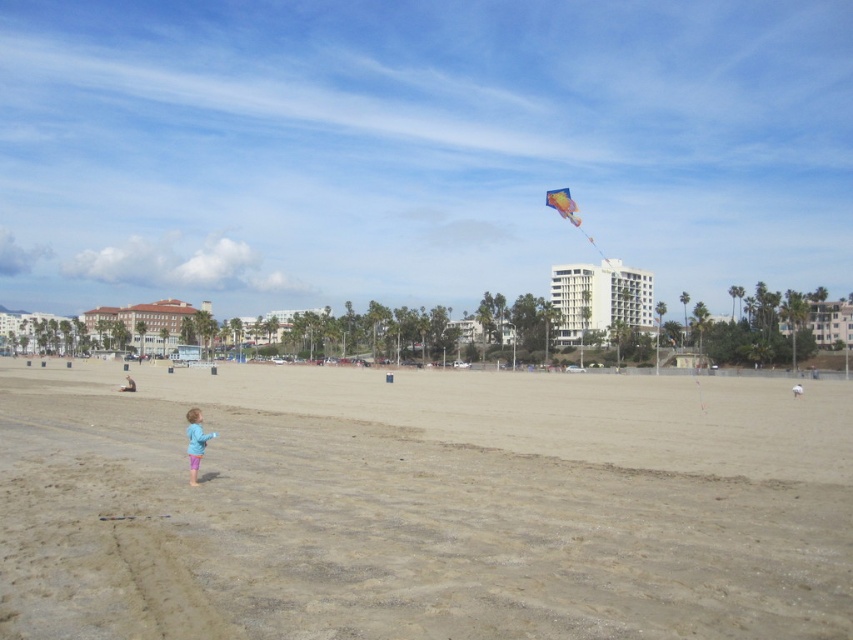
You are a photographer trying to capture a photo of the smooth sand beach at lower center and the blue fabric person at lower left. Based on their positions, which object should you focus on first if you want to include both in the same frame without moving the camera?

The blue fabric person at lower left should be focused on first because the smooth sand beach at lower center is located above it, so adjusting focus to the lower position ensures both can be captured in the frame.

You are a photographer trying to capture a wide shot of the smooth sand beach at lower center and the blue fabric person at lower left. Given that you want both subjects to be clearly visible in the frame, which object should you focus on first to ensure depth of field?

The smooth sand beach at lower center has a larger size compared to the blue fabric person at lower left, so focusing on the larger subject first will help ensure both are in focus due to its greater distance from the camera.

You are planning to set up a picnic blanket on the smooth sand beach at lower center. However, there is a blue fabric person at lower left nearby. Based on the scene description, can you determine if there is enough space between them to place the blanket without being too close?

The smooth sand beach at lower center might be wider than blue fabric person at lower left, so there might be enough space to place the picnic blanket without being too close to the blue fabric person at lower left.